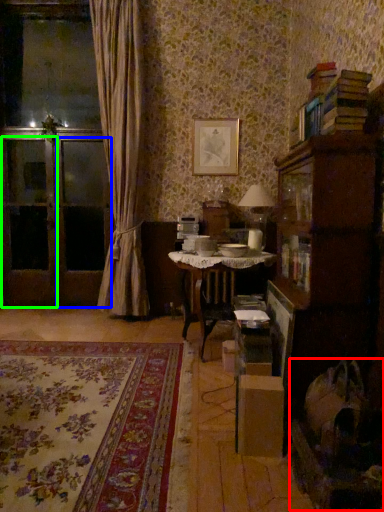
Question: Estimate the real-world distances between objects in this image. Which object is farther from swivel chair (highlighted by a red box), screen door (highlighted by a blue box) or screen door (highlighted by a green box)?

Choices:
 (A) screen door
 (B) screen door

Answer: (B)